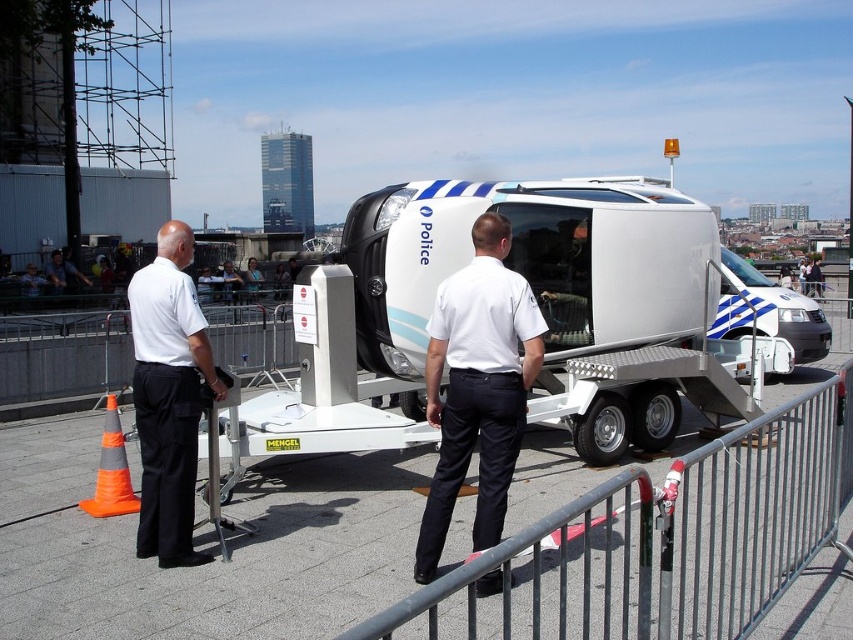
Is white uniform at left positioned before orange reflective cone at lower left?

Yes, it is in front of orange reflective cone at lower left.

Which of these two, white uniform at left or orange reflective cone at lower left, stands shorter?

orange reflective cone at lower left is shorter.

The image size is (853, 640). I want to click on white uniform at left, so click(x=167, y=396).

Does white uniform at left lie behind white glossy van at center?

That is False.

Which is behind, point (184, 502) or point (776, 284)?

Positioned behind is point (776, 284).

This screenshot has width=853, height=640. What do you see at coordinates (167, 396) in the screenshot?
I see `white uniform at left` at bounding box center [167, 396].

The image size is (853, 640). I want to click on white uniform at left, so click(x=167, y=396).

Which is in front, point (495, 266) or point (50, 262)?

Point (495, 266)

The width and height of the screenshot is (853, 640). Find the location of `white smooth shirt at center`. white smooth shirt at center is located at coordinates (479, 387).

Image resolution: width=853 pixels, height=640 pixels. I want to click on white smooth shirt at center, so click(x=479, y=387).